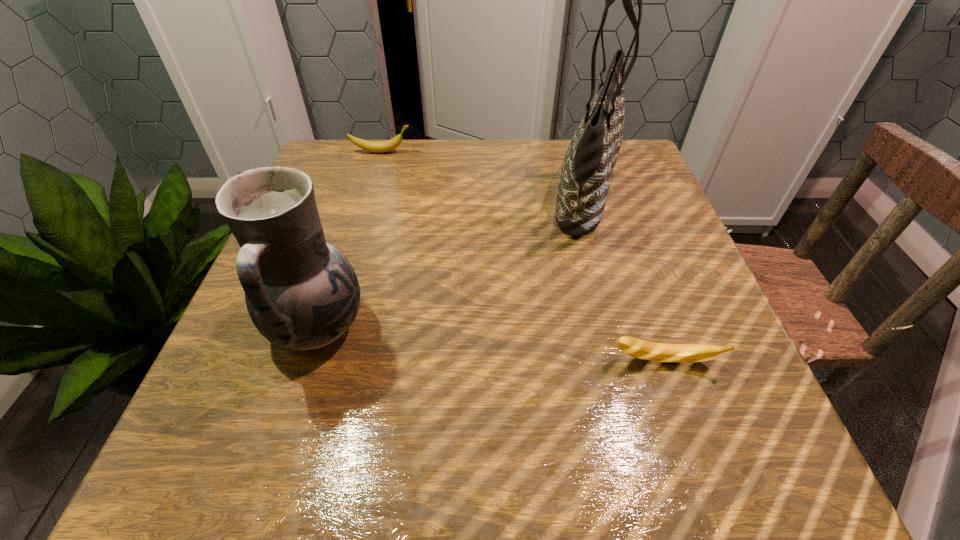
The image size is (960, 540). I want to click on free space between the right banana and the tote bag, so click(625, 276).

What are the coordinates of `free space between the shorter banana and the taller banana` in the screenshot? It's located at (522, 256).

The image size is (960, 540). Identify the location of vacant space that is in between the shorter banana and the tote bag. (625, 276).

The image size is (960, 540). I want to click on vacant space that is in between the right banana and the second tallest object, so [x=491, y=345].

Locate an element on the screen. The image size is (960, 540). object that stands as the closest to the third shortest object is located at coordinates (583, 187).

Identify which object is the second closest to the pitcher. Please provide its 2D coordinates. Your answer should be formatted as a tuple, i.e. [(x, y)], where the tuple contains the x and y coordinates of a point satisfying the conditions above.

[(675, 353)]

This screenshot has height=540, width=960. What are the coordinates of `free space in the image that satisfies the following two spatial constraints: 1. on the front side of the tote bag; 2. on the front-facing side of the second tallest object` in the screenshot? It's located at (627, 327).

This screenshot has width=960, height=540. I want to click on free location that satisfies the following two spatial constraints: 1. on the front side of the tote bag; 2. on the front-facing side of the third shortest object, so click(627, 327).